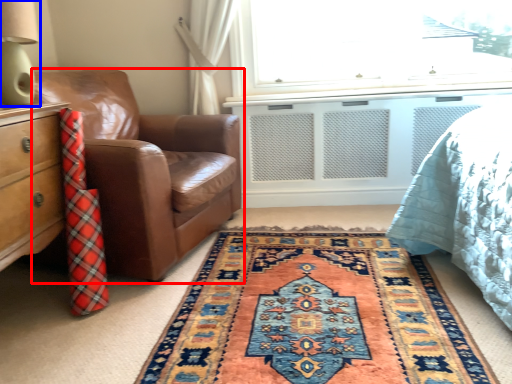
Question: Which object appears closest to the camera in this image, chair (highlighted by a red box) or table lamp (highlighted by a blue box)?

Choices:
 (A) chair
 (B) table lamp

Answer: (B)